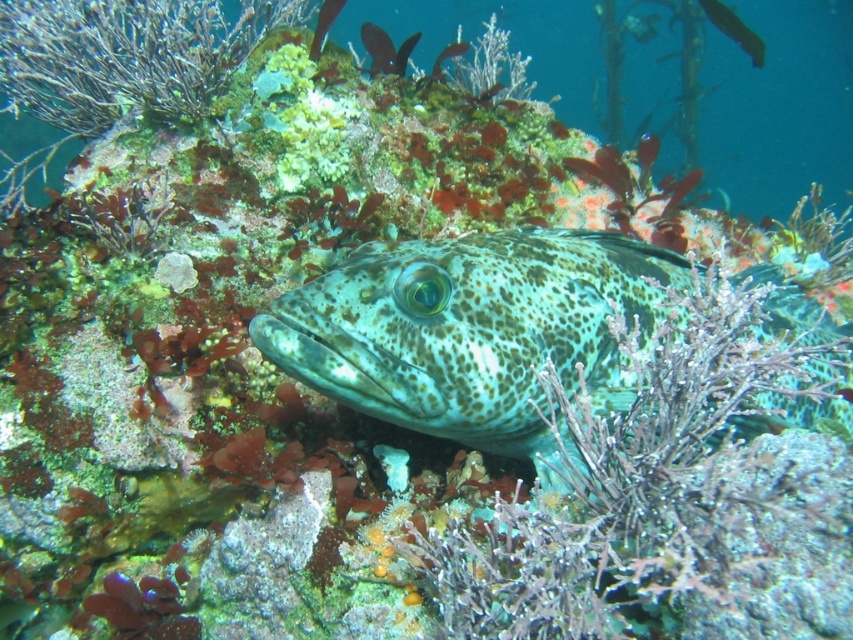
Which is more to the right, speckled green fish at upper right or speckled green fish at center?

From the viewer's perspective, speckled green fish at upper right appears more on the right side.

Which is in front, point (756, 51) or point (434, 58)?

Point (756, 51) is in front.

Is point (720, 3) positioned behind point (439, 72)?

Yes, it is.

The image size is (853, 640). Identify the location of speckled green fish at upper right. (734, 29).

Can you confirm if spotted green fish at upper center is bigger than speckled green fish at upper right?

No.

Does spotted green fish at upper center appear over speckled green fish at upper right?

Incorrect, spotted green fish at upper center is not positioned above speckled green fish at upper right.

Is point (364, 26) less distant than point (761, 60)?

Yes, point (364, 26) is in front of point (761, 60).

Where is `spotted green fish at upper center`? spotted green fish at upper center is located at coordinates (386, 49).

Can you confirm if speckled greenish-blue fish at center is positioned below speckled green fish at upper right?

Yes.

Can you confirm if speckled greenish-blue fish at center is thinner than speckled green fish at upper right?

No, speckled greenish-blue fish at center is not thinner than speckled green fish at upper right.

I want to click on speckled greenish-blue fish at center, so click(473, 330).